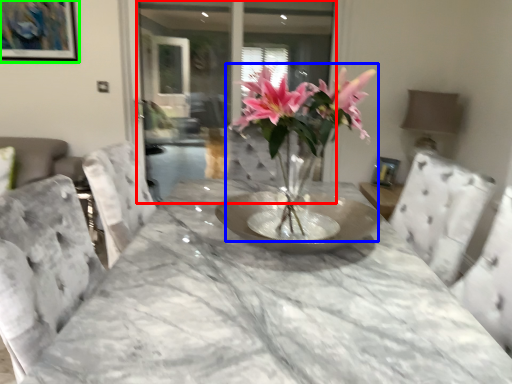
Question: Based on their relative distances, which object is farther from glass door (highlighted by a red box)? Choose from houseplant (highlighted by a blue box) and picture frame (highlighted by a green box).

Choices:
 (A) houseplant
 (B) picture frame

Answer: (A)